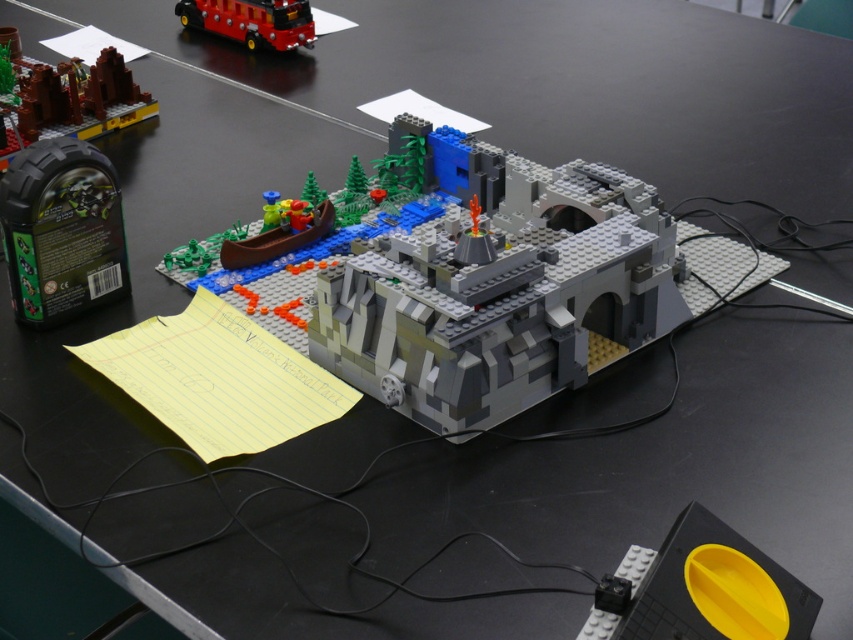
Consider the image. Does brick red lego set at upper left have a greater width compared to shiny red bus at upper left?

Incorrect, brick red lego set at upper left's width does not surpass shiny red bus at upper left's.

Is brick red lego set at upper left bigger than shiny red bus at upper left?

Yes, brick red lego set at upper left is bigger than shiny red bus at upper left.

Is point (0, 104) positioned behind point (250, 17)?

That is False.

Where is `brick red lego set at upper left`? The width and height of the screenshot is (853, 640). brick red lego set at upper left is located at coordinates (71, 100).

Between point (503, 296) and point (210, 16), which one is positioned in front?

Point (503, 296) is in front.

Is gray matte volcano at center above shiny red bus at upper left?

No, gray matte volcano at center is not above shiny red bus at upper left.

Locate an element on the screen. The width and height of the screenshot is (853, 640). gray matte volcano at center is located at coordinates (483, 280).

Which of these two, yellow matte plate at lower right or brick red lego set at upper left, stands shorter?

yellow matte plate at lower right is shorter.

Who is more forward, [750,593] or [16,115]?

Point [750,593] is in front.

I want to click on yellow matte plate at lower right, so click(x=700, y=589).